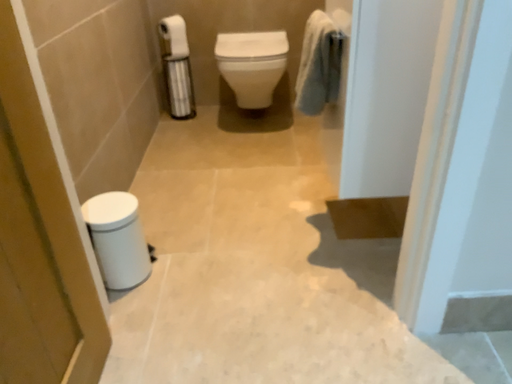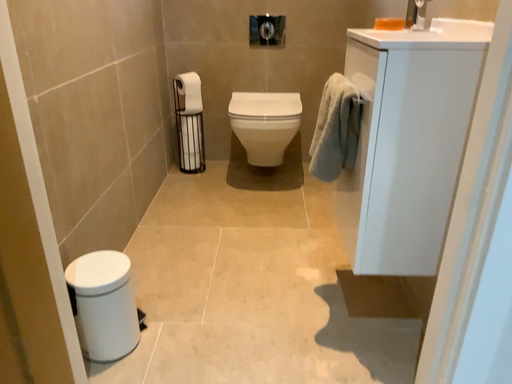
Question: Which way did the camera rotate in the video?

Choices:
 (A) rotated downward
 (B) rotated upward

Answer: (B)